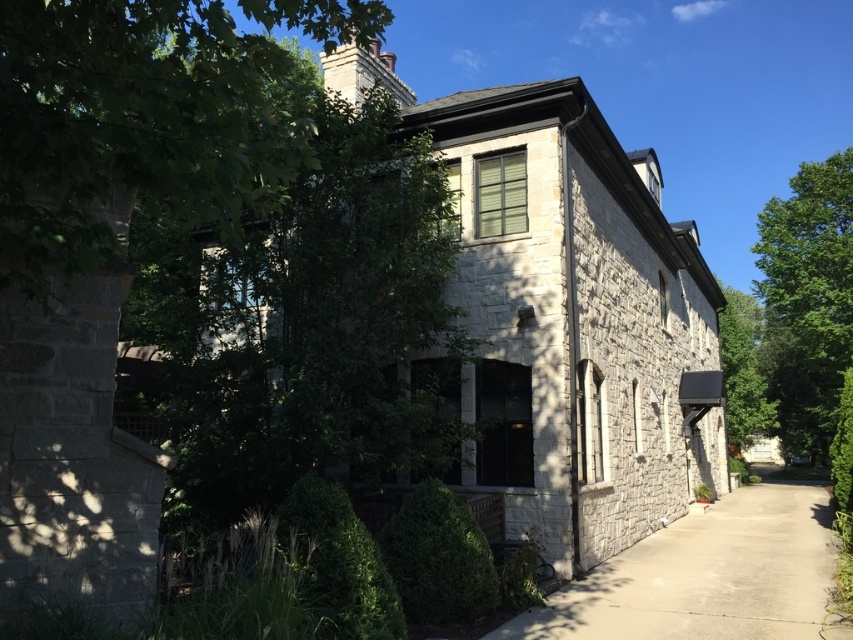
Question: Which point appears farthest from the camera in this image?

Choices:
 (A) (6, 196)
 (B) (824, 394)
 (C) (653, 544)

Answer: (B)

Question: Does green leafy tree at left have a smaller size compared to concrete at lower right?

Choices:
 (A) no
 (B) yes

Answer: (B)

Question: Which object is positioned farthest from the green leafy tree at left?

Choices:
 (A) concrete at lower right
 (B) green leafy tree at right

Answer: (B)

Question: Can you confirm if green leafy tree at left is positioned to the right of green leafy tree at right?

Choices:
 (A) yes
 (B) no

Answer: (B)

Question: Can you confirm if green leafy tree at left is smaller than green leafy tree at right?

Choices:
 (A) no
 (B) yes

Answer: (B)

Question: Which of the following is the farthest from the observer?

Choices:
 (A) green leafy tree at right
 (B) concrete at lower right
 (C) green leafy tree at left

Answer: (A)